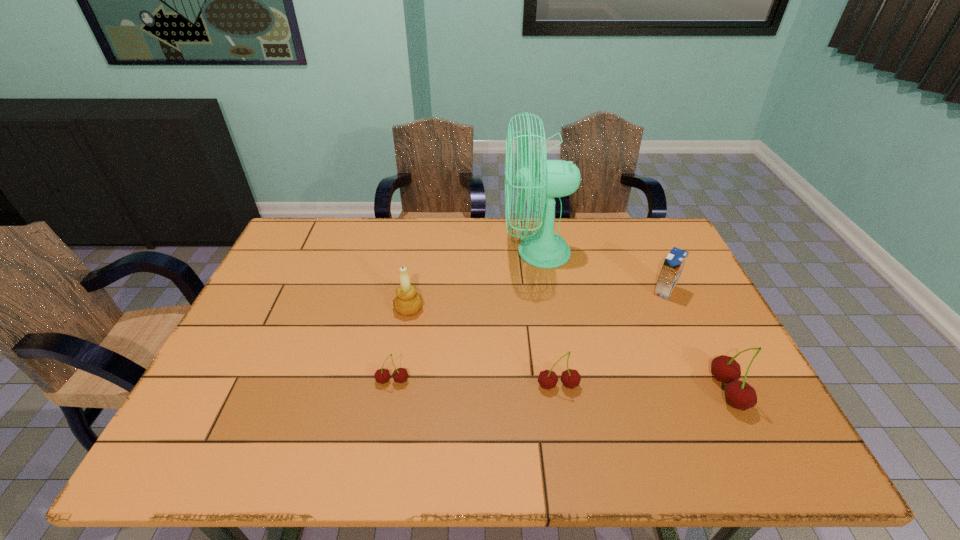
Locate an element on the screen. vacant area at the far edge is located at coordinates (457, 246).

This screenshot has height=540, width=960. In the image, there is a desktop. Find the location of `free region at the near edge`. free region at the near edge is located at coordinates (513, 404).

The width and height of the screenshot is (960, 540). I want to click on vacant region at the left edge, so click(x=300, y=264).

Where is `vacant space at the right edge of the desktop`? vacant space at the right edge of the desktop is located at coordinates (717, 319).

In order to click on blank area at the far left corner in this screenshot , I will do `click(302, 225)`.

Where is `free region at the near left corner of the desktop`? The image size is (960, 540). free region at the near left corner of the desktop is located at coordinates (265, 390).

In the image, there is a desktop. Where is `vacant space at the far right corner`? vacant space at the far right corner is located at coordinates (635, 231).

This screenshot has height=540, width=960. Find the location of `unoccupied position between the second shortest cherry and the tallest cherry`. unoccupied position between the second shortest cherry and the tallest cherry is located at coordinates (642, 388).

Where is `free spot between the orange_juice and the tallest cherry`? This screenshot has width=960, height=540. free spot between the orange_juice and the tallest cherry is located at coordinates (696, 341).

The image size is (960, 540). I want to click on vacant point located between the tallest object and the tallest cherry, so point(632,322).